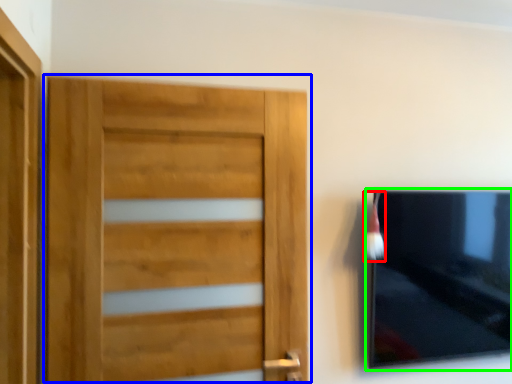
Question: Which object is positioned farthest from brush (highlighted by a red box)? Select from door (highlighted by a blue box) and picture frame (highlighted by a green box).

Choices:
 (A) door
 (B) picture frame

Answer: (A)